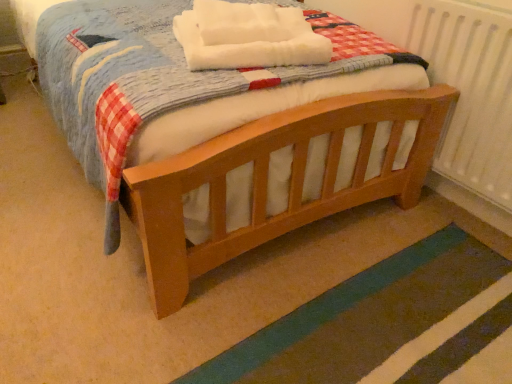
I want to click on vacant area that lies between white textured radiator at right and teal rug at lower right, so click(x=332, y=254).